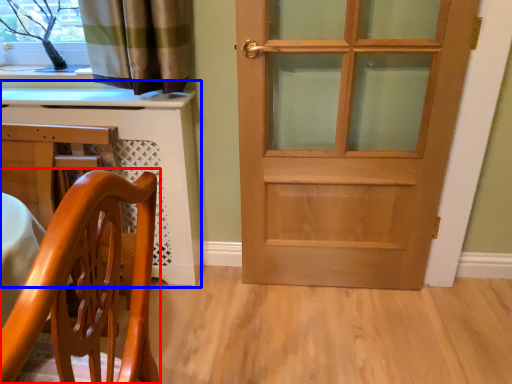
Question: Among these objects, which one is farthest to the camera, chair (highlighted by a red box) or computer desk (highlighted by a blue box)?

Choices:
 (A) chair
 (B) computer desk

Answer: (B)